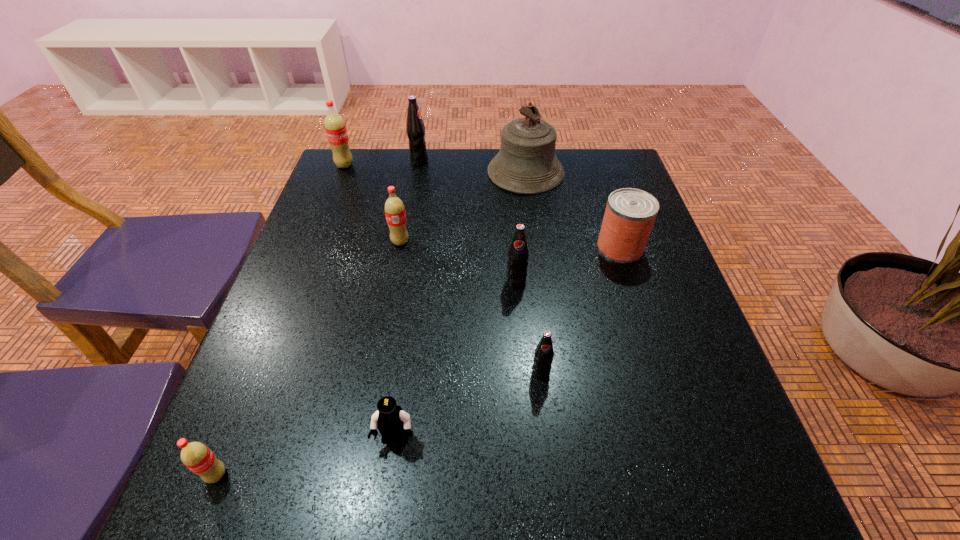
The height and width of the screenshot is (540, 960). Identify the location of the smallest black pop. (543, 356).

Find the location of `the nearest object`. the nearest object is located at coordinates (196, 456).

Identify the location of the nearest soda. The height and width of the screenshot is (540, 960). (196, 456).

This screenshot has width=960, height=540. What are the coordinates of `Lego` in the screenshot? It's located at (390, 419).

Image resolution: width=960 pixels, height=540 pixels. What are the coordinates of `black Lego` in the screenshot? It's located at (390, 419).

Where is `vacant space situated on the left of the bell`? This screenshot has width=960, height=540. vacant space situated on the left of the bell is located at coordinates (453, 172).

Locate an element on the screen. vacant space located on the front label of the leftmost black pop is located at coordinates [563, 161].

Find the location of `free space located on the front of the biggest red soda`. free space located on the front of the biggest red soda is located at coordinates (332, 197).

Where is `vacant point located 0.230m on the front label of the second biggest black pop`? vacant point located 0.230m on the front label of the second biggest black pop is located at coordinates (524, 382).

I want to click on free space located 0.300m on the front of the second biggest red soda, so click(379, 354).